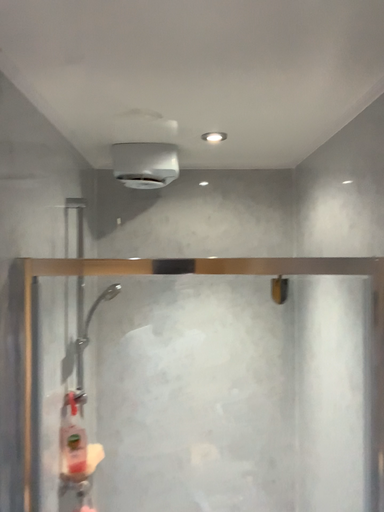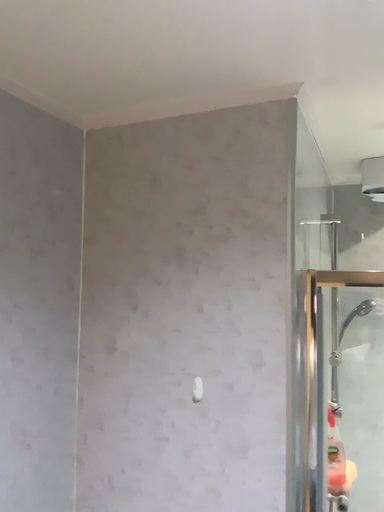
Question: Which way did the camera rotate in the video?

Choices:
 (A) rotated right
 (B) rotated left

Answer: (B)